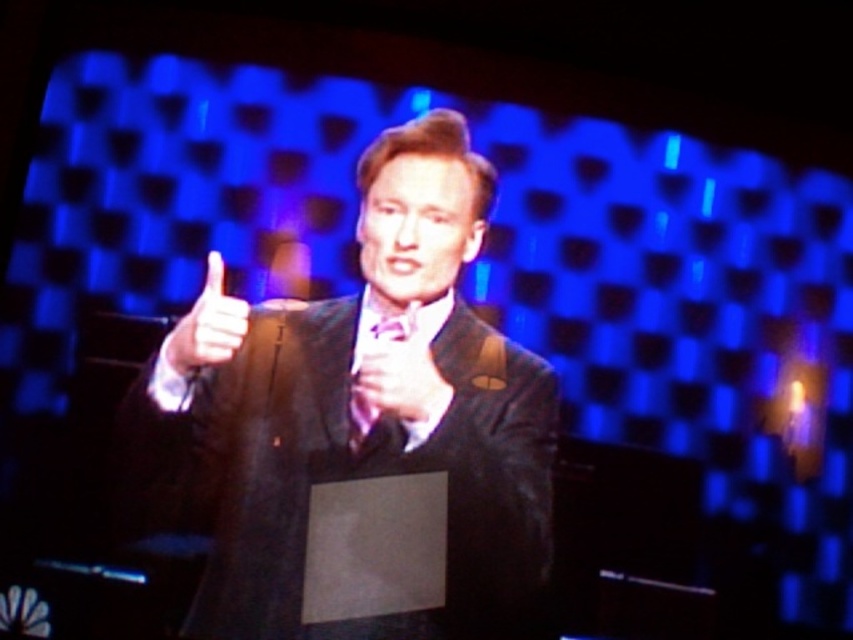
Question: Does shiny black suit at center appear over matte purple tie at center?

Choices:
 (A) yes
 (B) no

Answer: (A)

Question: Which of the following is the closest to the observer?

Choices:
 (A) (367, 413)
 (B) (554, 403)
 (C) (236, 310)

Answer: (A)

Question: Considering the real-world distances, which object is farthest from the shiny black suit at center?

Choices:
 (A) matte black hand at center
 (B) matte purple tie at center
 (C) matte black thumb at left

Answer: (C)

Question: Does matte black hand at center come in front of matte purple tie at center?

Choices:
 (A) no
 (B) yes

Answer: (A)

Question: Where is matte black thumb at left located in relation to matte purple tie at center in the image?

Choices:
 (A) left
 (B) right

Answer: (A)

Question: Which point is farther from the camera taking this photo?

Choices:
 (A) (372, 406)
 (B) (451, 557)
 (C) (186, 369)
 (D) (438, 404)

Answer: (C)